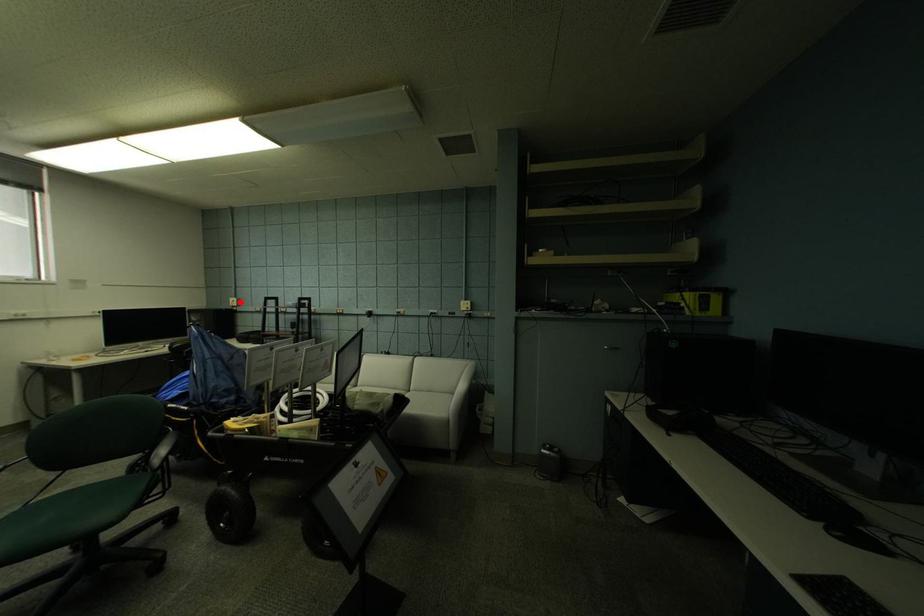
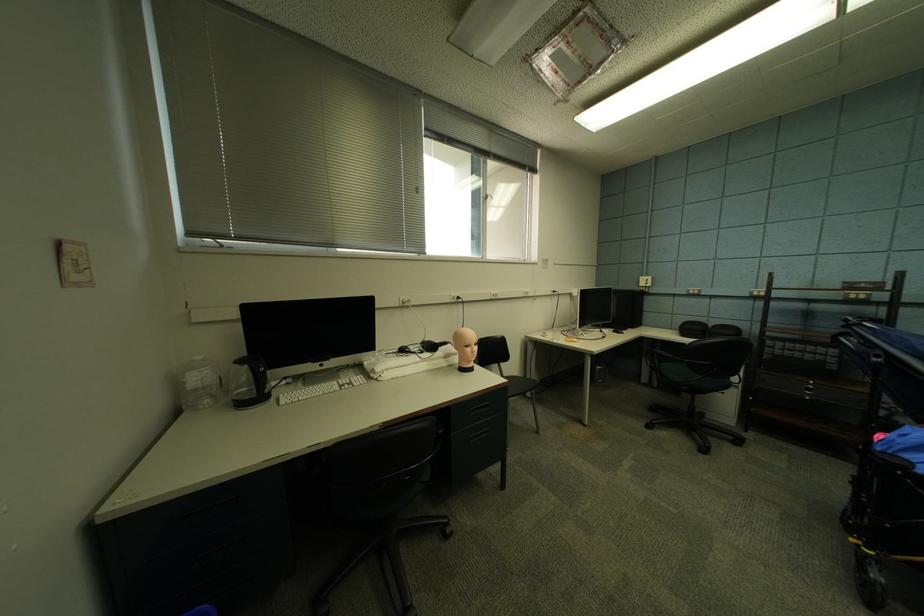
In the second image, find the point that corresponds to the highlighted location in the first image.

(650, 282)